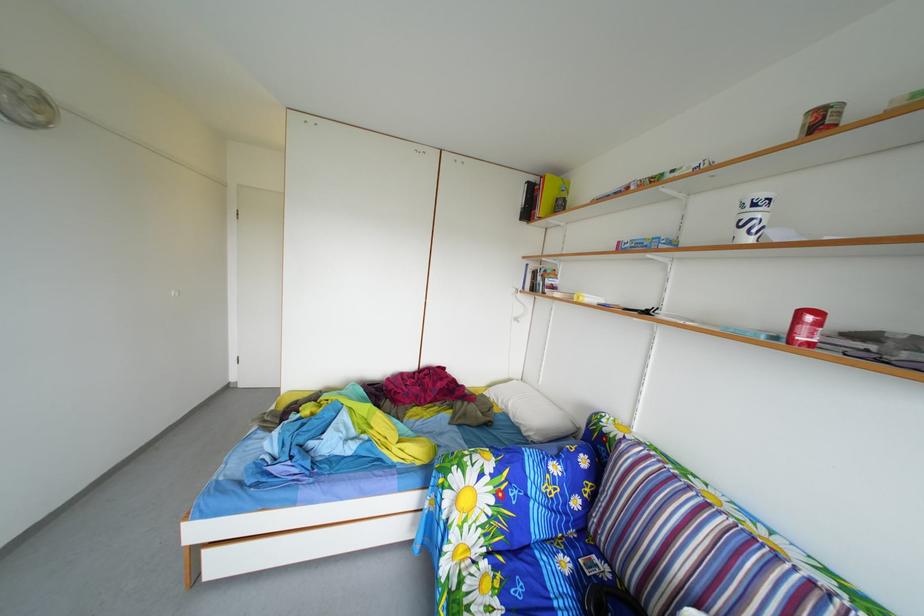
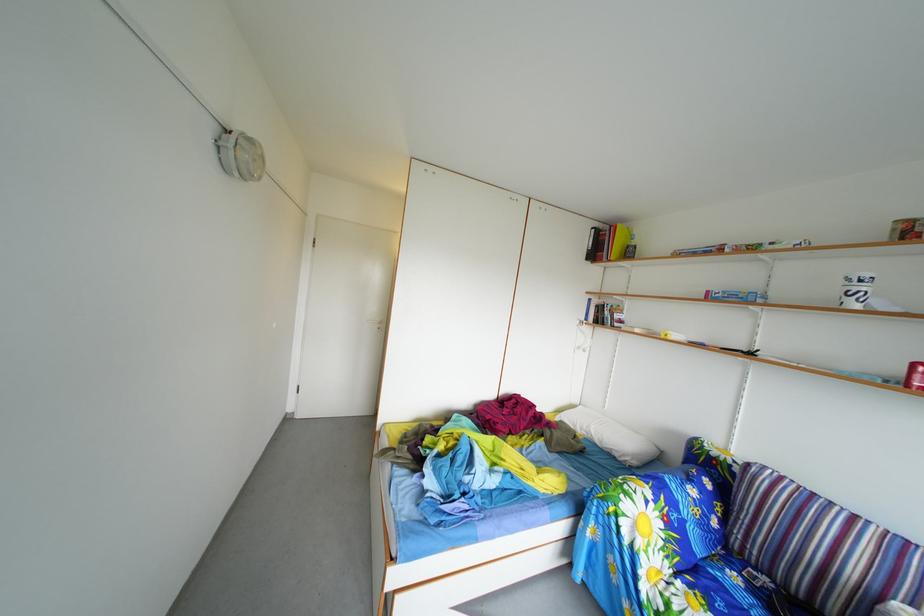
Find the pixel in the second image that matches point 543,187 in the first image.

(608, 233)